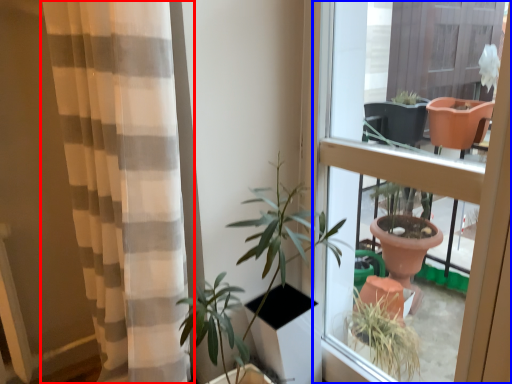
Question: Which point is closer to the camera, curtain (highlighted by a red box) or window (highlighted by a blue box)?

Choices:
 (A) curtain
 (B) window

Answer: (A)